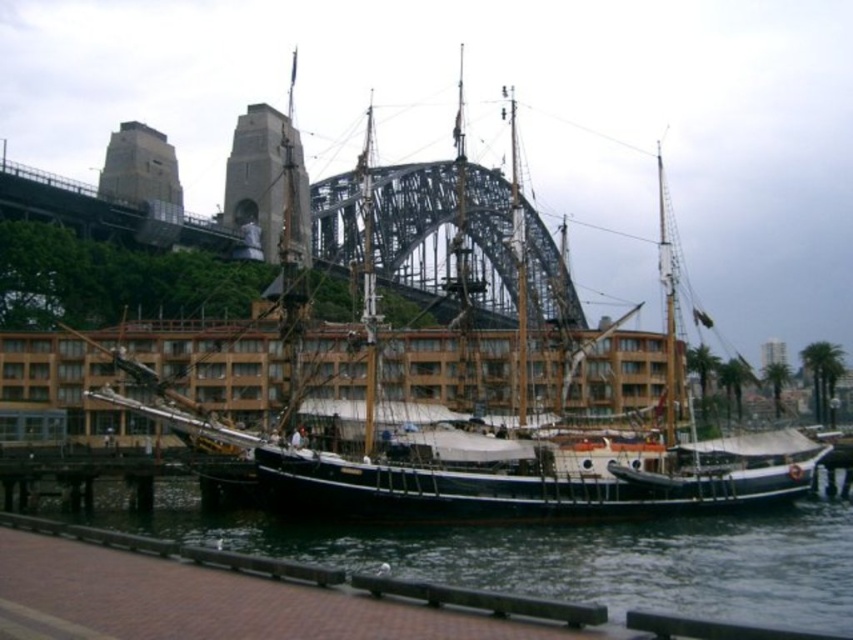
You are standing on the pier and want to board the wooden ship at center. The safety regulations state that you must be within 50 meters to board. Can you board the ship?

The wooden ship at center is 53.35 meters away from the viewer, which exceeds the 50 meters safety regulation distance. Therefore, you cannot board the ship.

You are a photographer standing on the pier and want to take a photo of the wooden ship at center and the black water at lower center. Which object will appear larger in your photo?

The wooden ship at center will appear larger in the photo because it is closer to the photographer than the black water at lower center.